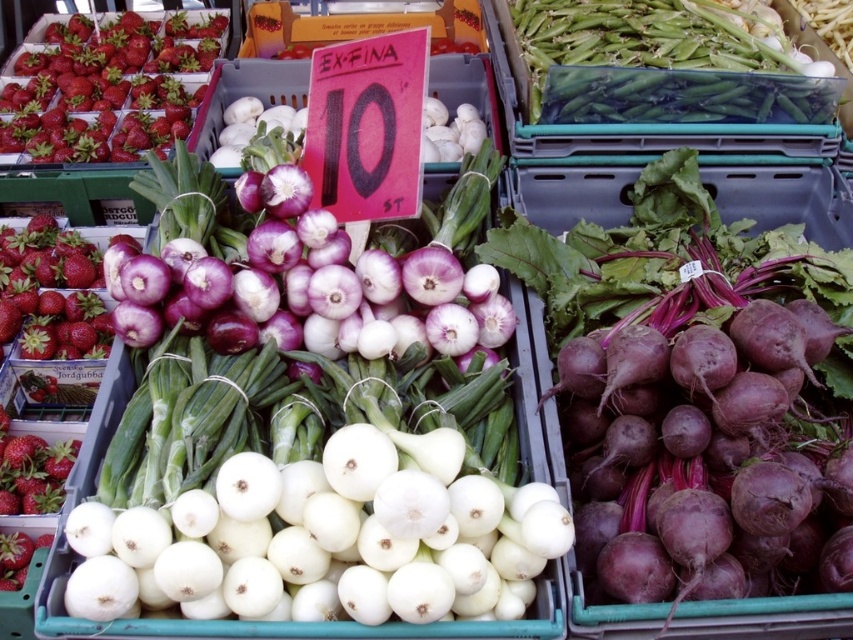
Question: Considering the relative positions of green smooth skin at upper center and shiny red strawberries at upper left in the image provided, where is green smooth skin at upper center located with respect to shiny red strawberries at upper left?

Choices:
 (A) above
 (B) below

Answer: (B)

Question: Which point is closer to the camera?

Choices:
 (A) (113, 29)
 (B) (628, 51)
 (C) (660, 465)

Answer: (C)

Question: Which of these objects is positioned farthest from the shiny red strawberries at upper left?

Choices:
 (A) green smooth skin at upper center
 (B) purple matte beetroot at right

Answer: (B)

Question: Can you confirm if purple matte beetroot at right is positioned below green smooth skin at upper center?

Choices:
 (A) yes
 (B) no

Answer: (A)

Question: Which object is the closest to the shiny red strawberries at upper left?

Choices:
 (A) green smooth skin at upper center
 (B) purple matte beetroot at right

Answer: (A)

Question: Can you confirm if green smooth skin at upper center is bigger than shiny red strawberries at upper left?

Choices:
 (A) no
 (B) yes

Answer: (A)